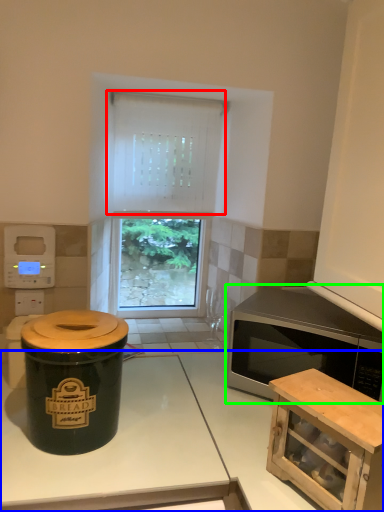
Question: Considering the real-world distances, which object is farthest from curtain (highlighted by a red box)? countertop (highlighted by a blue box) or microwave oven (highlighted by a green box)?

Choices:
 (A) countertop
 (B) microwave oven

Answer: (A)